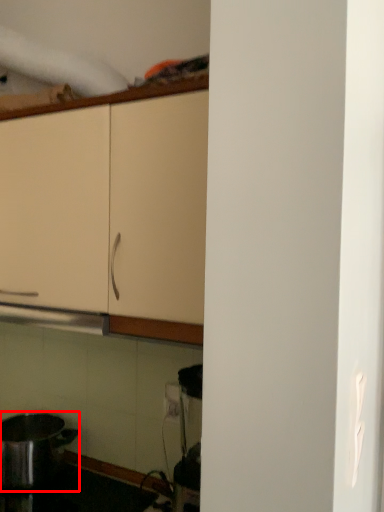
Question: From the image's perspective, where is kitchen appliance (annotated by the red box) located in relation to cabinetry in the image?

Choices:
 (A) below
 (B) above

Answer: (A)